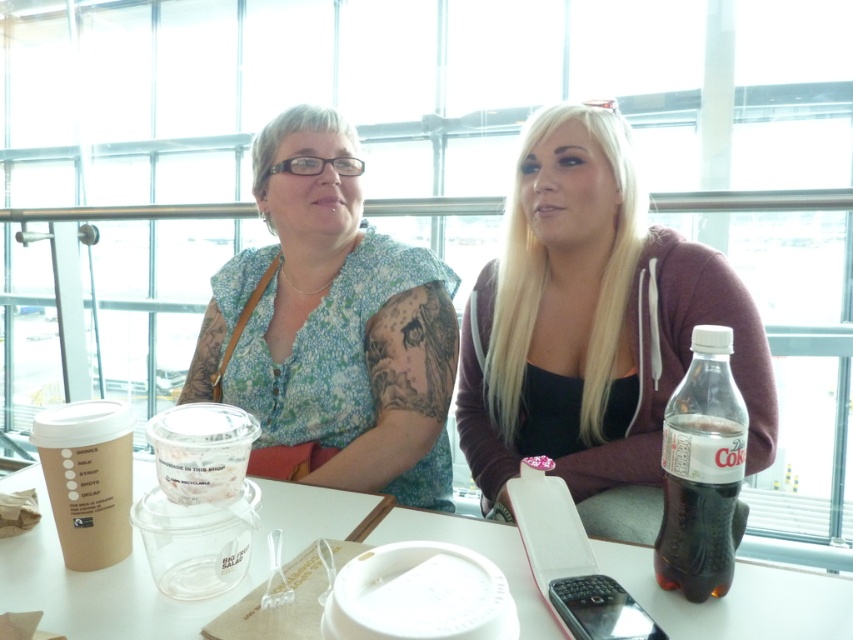
You are a barista preparing a drink for a customer. You see a matte black hoodie at center and a clear plastic bottle at right on the table. Where should you place the drink so it doesn t spill? Explain your reasoning.

The matte black hoodie at center is above the clear plastic bottle at right, so placing the drink on the clear plastic bottle at right would risk spilling since it is lower and might be unstable. The matte black hoodie at center is a better option as it is higher and more stable.

You are standing in the room and want to take a photo of the point at coordinates (477, 483). If your camera has a focal length of 50mm and you are 1.25 meters away from the point, what is the approximate angle of view needed to capture the point clearly?

The point at coordinates (477, 483) is 1.25 meters from the camera. Using the formula for angle of view, the required angle can be calculated to ensure the point is within the frame.

You are a barista who needs to place a new order on the table. The customer has requested a hot beverage. However, there is already a matte black hoodie at center and a brown paper cup at left on the table. Can you place the new beverage on the table without moving any existing items?

The matte black hoodie at center is positioned over brown paper cup at left, meaning the hoodie is covering the cup. To place the new beverage, you would need to move either the hoodie or the cup to avoid spilling the drink or damaging the hoodie.